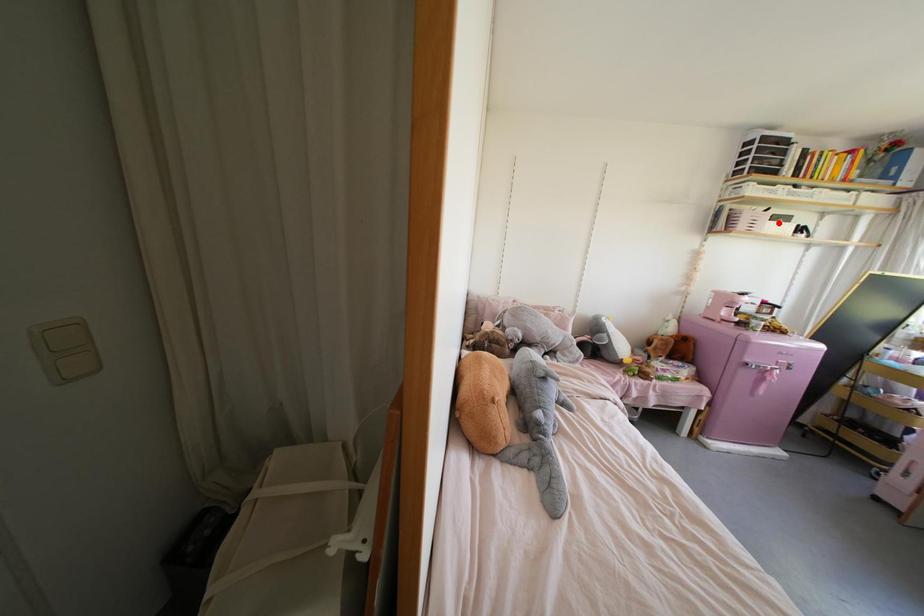
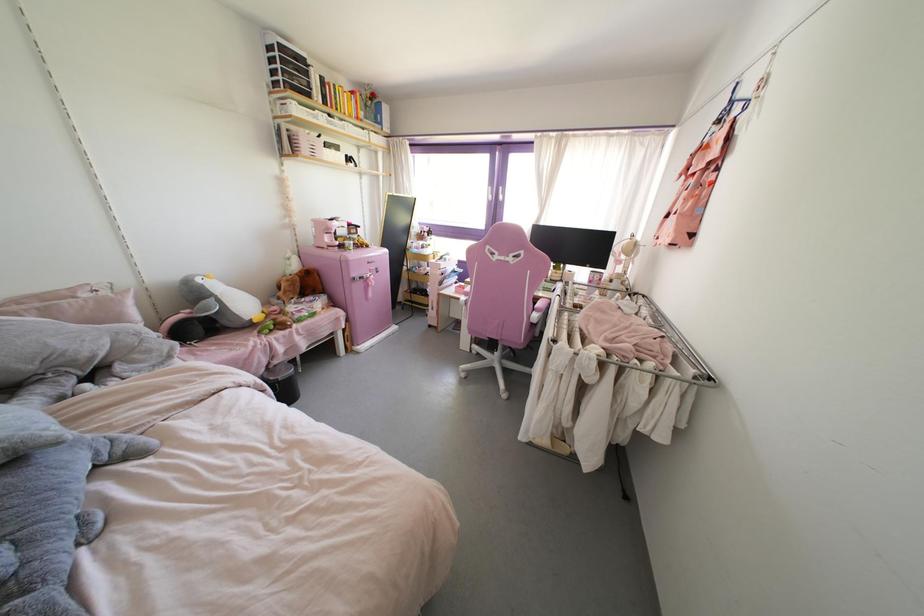
Question: I am providing you with two images of the same scene from different viewpoints. Image1 has a red point marked. In image2, the corresponding 3D location appears at what relative position? Reply with the corresponding letter.

Choices:
 (A) Closer
 (B) Farther

Answer: (A)